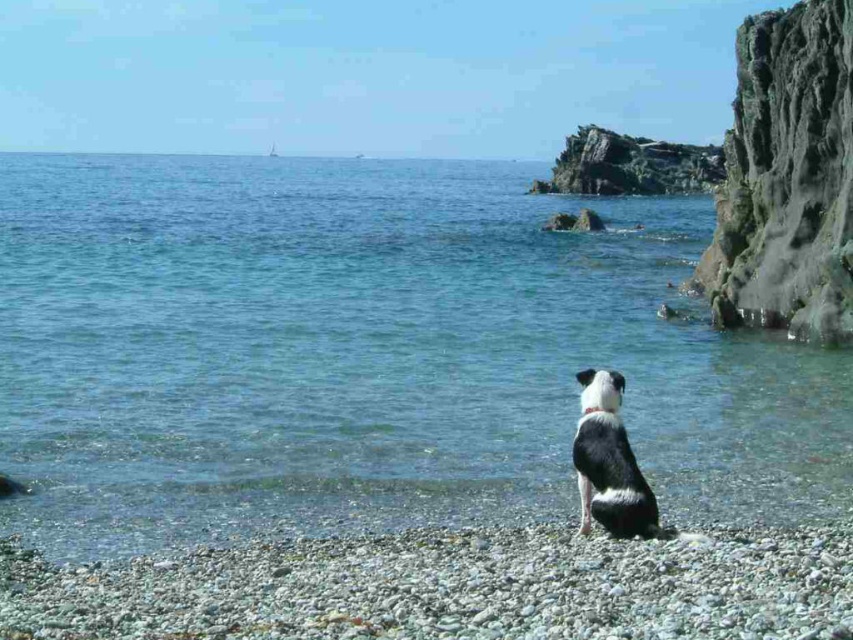
Question: Which point is closer to the camera?

Choices:
 (A) black and white fur dog at center
 (B) clear blue water at center
 (C) smooth pebbles at lower center
 (D) green mossy rock at right

Answer: (C)

Question: Is clear blue water at center behind green mossy rock at right?

Choices:
 (A) no
 (B) yes

Answer: (A)

Question: Is green mossy rock at right to the left of black and white fur dog at center from the viewer's perspective?

Choices:
 (A) yes
 (B) no

Answer: (B)

Question: Estimate the real-world distances between objects in this image. Which object is closer to the smooth pebbles at lower center?

Choices:
 (A) clear blue water at center
 (B) black and white fur dog at center
 (C) green mossy rock at right

Answer: (B)

Question: Is clear blue water at center below smooth pebbles at lower center?

Choices:
 (A) no
 (B) yes

Answer: (A)

Question: Which point is closer to the camera taking this photo?

Choices:
 (A) (798, 317)
 (B) (596, 413)
 (C) (194, 426)

Answer: (B)